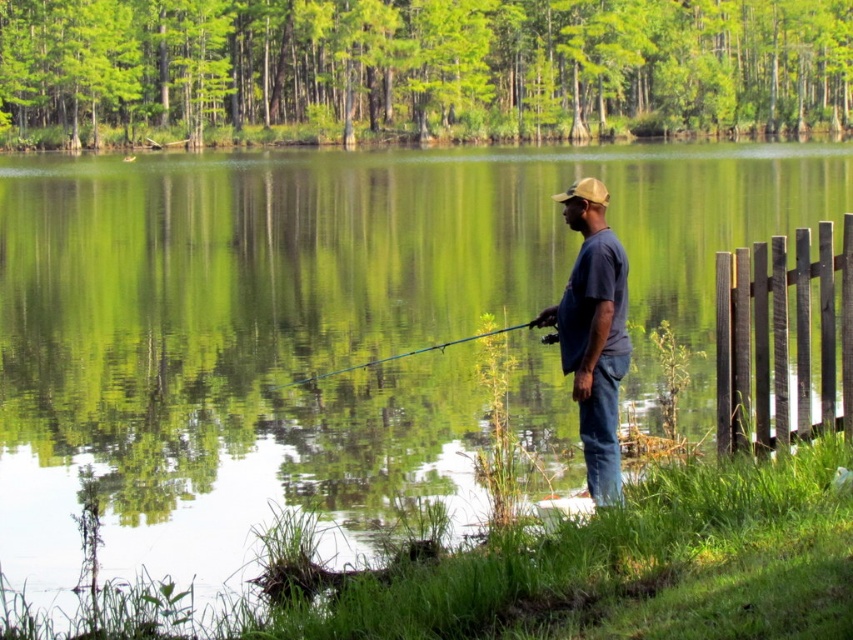
In the scene shown: Can you confirm if brown wooden fence at right is smaller than blue cotton shirt at center?

Yes, brown wooden fence at right is smaller than blue cotton shirt at center.

Is point (759, 342) positioned behind point (599, 371)?

Yes, point (759, 342) is behind point (599, 371).

Find the location of `brown wooden fence at right`. brown wooden fence at right is located at coordinates (780, 337).

Between point (590, 184) and point (485, 333), which one is positioned behind?

The point (485, 333) is more distant.

Does blue cotton shirt at center have a greater width compared to teal fiberglass rod at center?

No.

Is point (549, 337) behind point (415, 355)?

That is False.

Identify the location of blue cotton shirt at center. (593, 333).

Can you confirm if brown wooden fence at right is positioned to the right of teal fiberglass rod at center?

Yes, brown wooden fence at right is to the right of teal fiberglass rod at center.

Which is below, brown wooden fence at right or teal fiberglass rod at center?

Positioned lower is teal fiberglass rod at center.

The image size is (853, 640). I want to click on brown wooden fence at right, so click(780, 337).